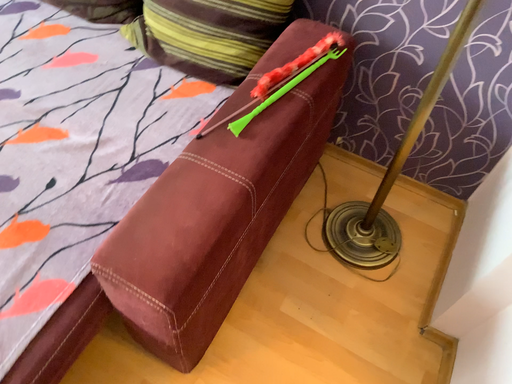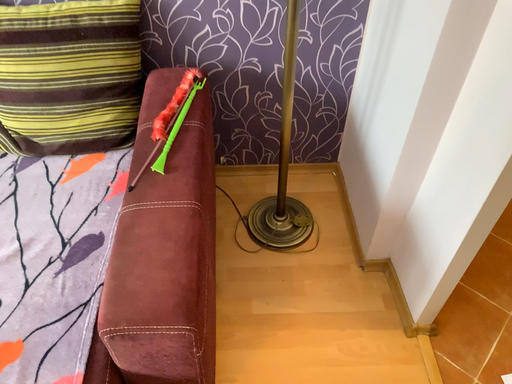
Question: Which way did the camera rotate in the video?

Choices:
 (A) rotated left
 (B) rotated right

Answer: (B)